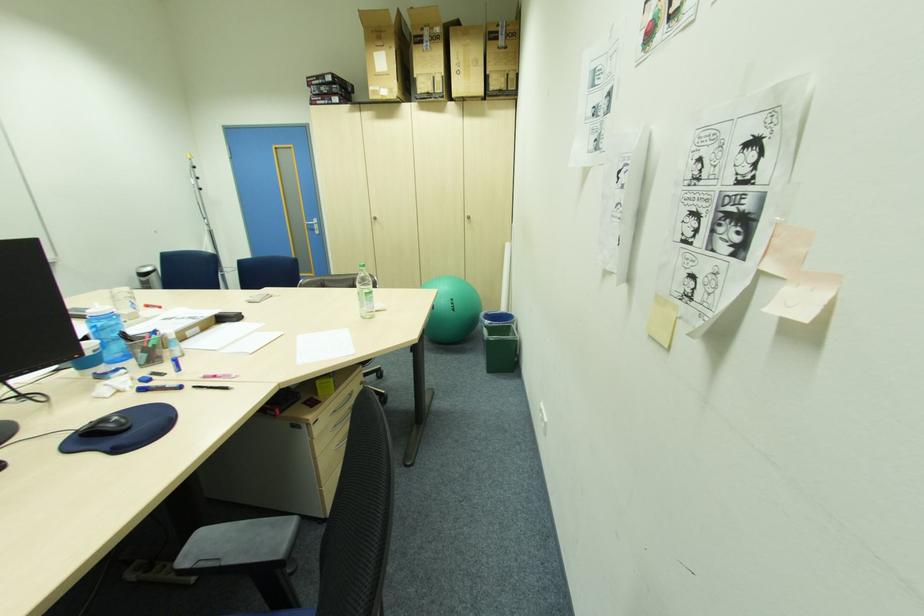
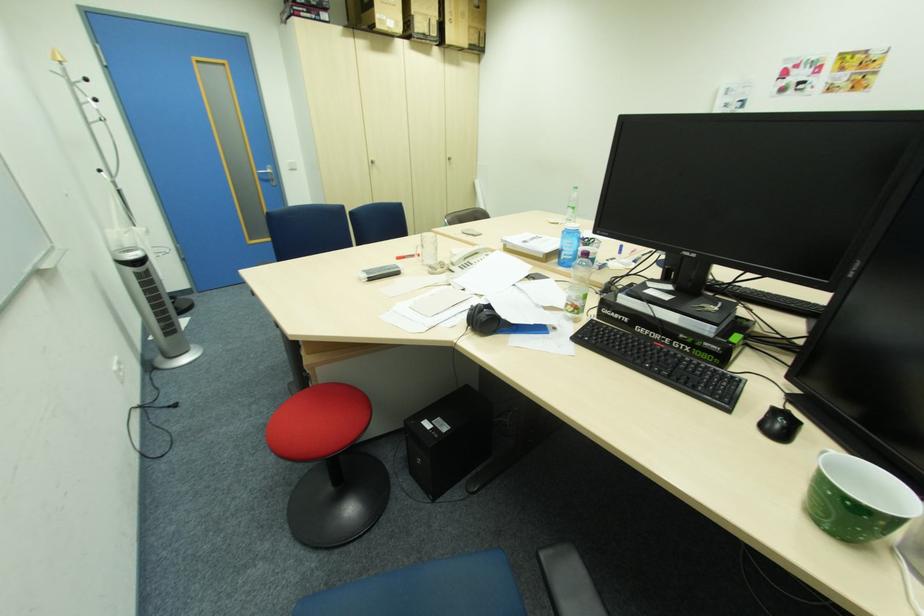
The point at (445, 90) is marked in the first image. Where is the corresponding point in the second image?

(441, 31)